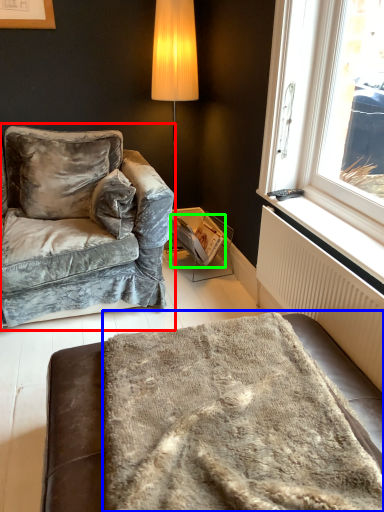
Question: Which object is positioned farthest from studio couch (highlighted by a red box)? Select from blanket (highlighted by a blue box) and magazine (highlighted by a green box).

Choices:
 (A) blanket
 (B) magazine

Answer: (A)